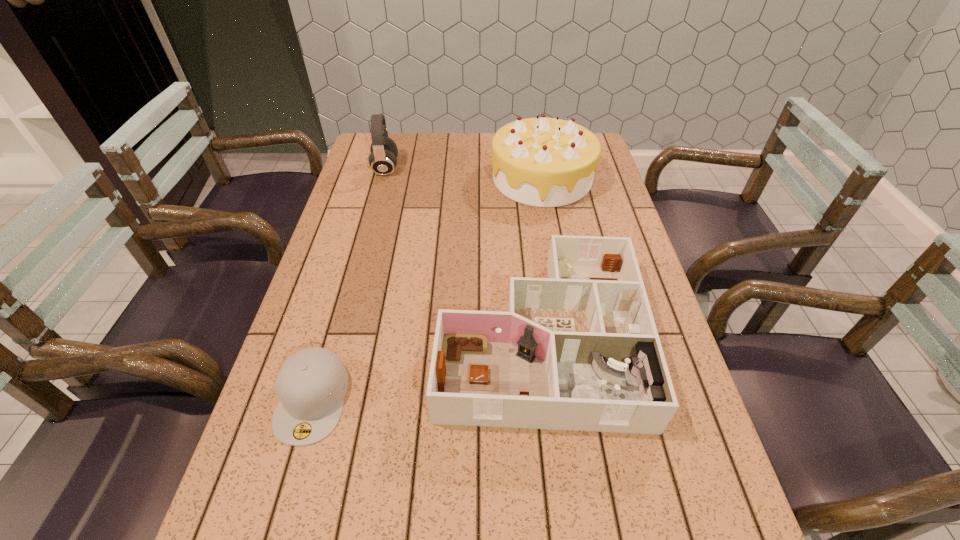
Identify the location of birthday cake. Image resolution: width=960 pixels, height=540 pixels. (544, 162).

This screenshot has height=540, width=960. In order to click on headset in this screenshot , I will do `click(383, 159)`.

Identify the location of dollhouse. (579, 350).

Find the location of a particular element. cap is located at coordinates (311, 384).

You are a GUI agent. You are given a task and a screenshot of the screen. Output one action in this format:
    pyautogui.click(x=<x>, y=<y>)
    Task: Click on the vacant space located 0.090m on the front of the birthday cake
    
    Given the screenshot: What is the action you would take?
    [x=551, y=228]

Locate an element on the screen. Image resolution: width=960 pixels, height=540 pixels. vacant space situated on the ear cups of the headset is located at coordinates (465, 168).

This screenshot has height=540, width=960. Identify the location of free region located on the front of the third tallest object. (560, 508).

I want to click on vacant space located on the front-facing side of the shortest object, so click(x=282, y=503).

Image resolution: width=960 pixels, height=540 pixels. I want to click on birthday cake that is at the far edge, so click(x=544, y=162).

This screenshot has height=540, width=960. Identify the location of headset present at the far edge. (383, 159).